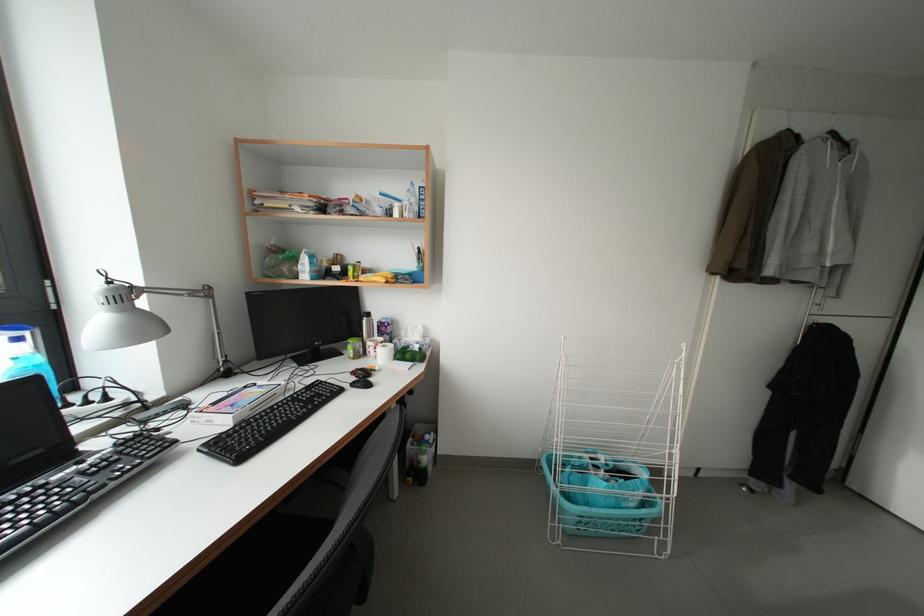
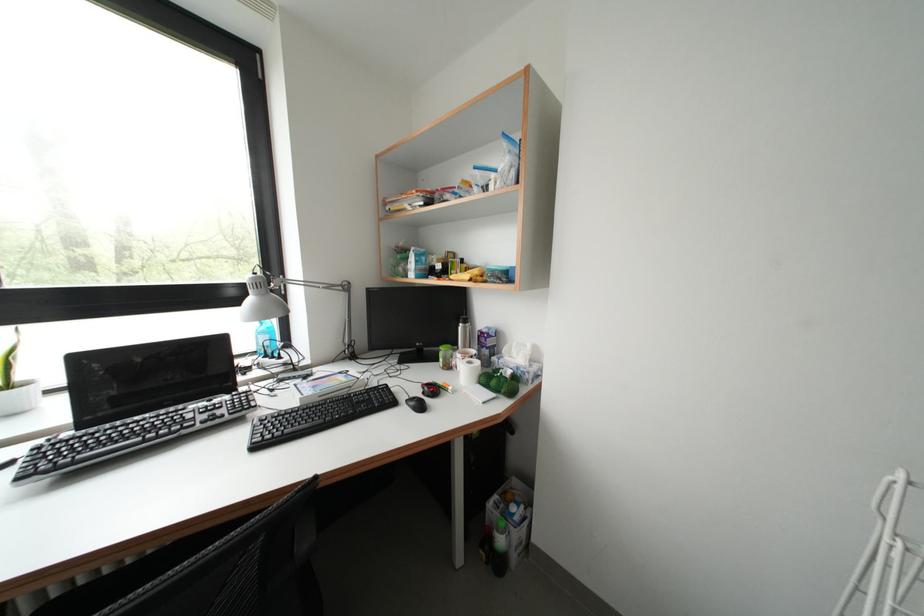
The point at (301, 265) is marked in the first image. Where is the corresponding point in the second image?

(415, 264)